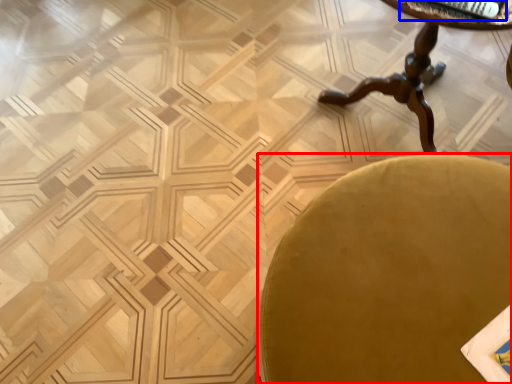
Question: Which object is further to the camera taking this photo, chair (highlighted by a red box) or magazine (highlighted by a blue box)?

Choices:
 (A) chair
 (B) magazine

Answer: (B)